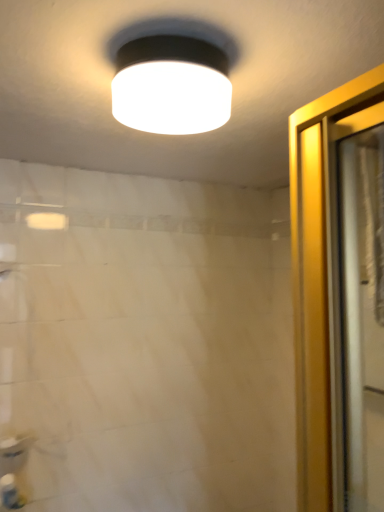
Question: Is the depth of translucent plastic shower curtain at right less than that of white plastic bottle at lower left?

Choices:
 (A) yes
 (B) no

Answer: (A)

Question: Would you say translucent plastic shower curtain at right is outside white plastic bottle at lower left?

Choices:
 (A) no
 (B) yes

Answer: (B)

Question: Is translucent plastic shower curtain at right thinner than white plastic bottle at lower left?

Choices:
 (A) yes
 (B) no

Answer: (A)

Question: Is translucent plastic shower curtain at right not close to white plastic bottle at lower left?

Choices:
 (A) no
 (B) yes

Answer: (B)

Question: Does translucent plastic shower curtain at right have a greater width compared to white plastic bottle at lower left?

Choices:
 (A) yes
 (B) no

Answer: (B)

Question: From the image's perspective, is translucent plastic shower curtain at right under white plastic bottle at lower left?

Choices:
 (A) no
 (B) yes

Answer: (A)

Question: Is white glossy sink at lower left beside translucent plastic shower curtain at right?

Choices:
 (A) yes
 (B) no

Answer: (B)

Question: Does white glossy sink at lower left have a smaller size compared to translucent plastic shower curtain at right?

Choices:
 (A) yes
 (B) no

Answer: (A)

Question: Is white glossy sink at lower left positioned with its back to translucent plastic shower curtain at right?

Choices:
 (A) yes
 (B) no

Answer: (B)

Question: From a real-world perspective, is white glossy sink at lower left positioned under translucent plastic shower curtain at right based on gravity?

Choices:
 (A) no
 (B) yes

Answer: (B)

Question: From the image's perspective, does white glossy sink at lower left appear higher than translucent plastic shower curtain at right?

Choices:
 (A) yes
 (B) no

Answer: (B)

Question: Does white glossy sink at lower left have a lesser height compared to translucent plastic shower curtain at right?

Choices:
 (A) no
 (B) yes

Answer: (B)

Question: Considering the relative positions of white matte lampshade at upper center and white glossy sink at lower left in the image provided, is white matte lampshade at upper center behind white glossy sink at lower left?

Choices:
 (A) no
 (B) yes

Answer: (A)